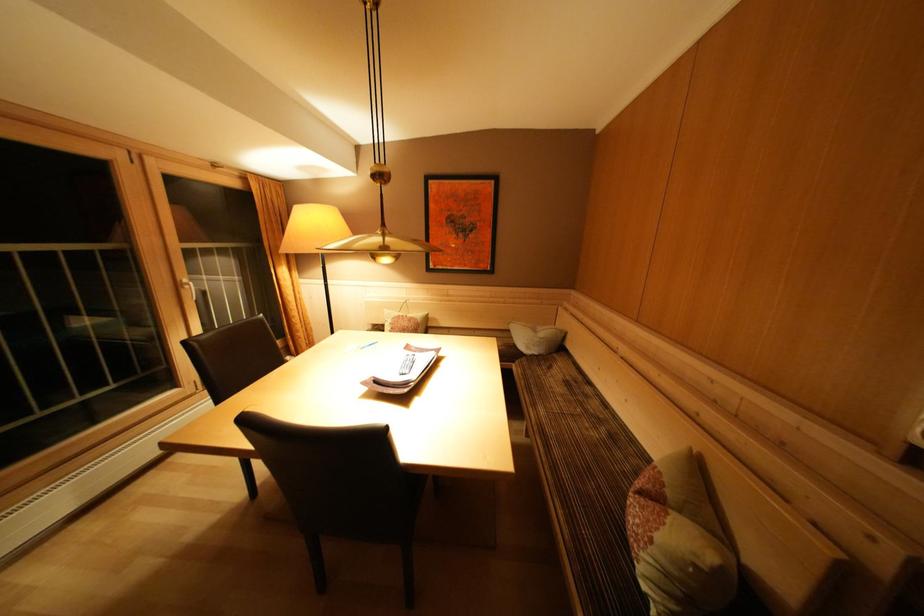
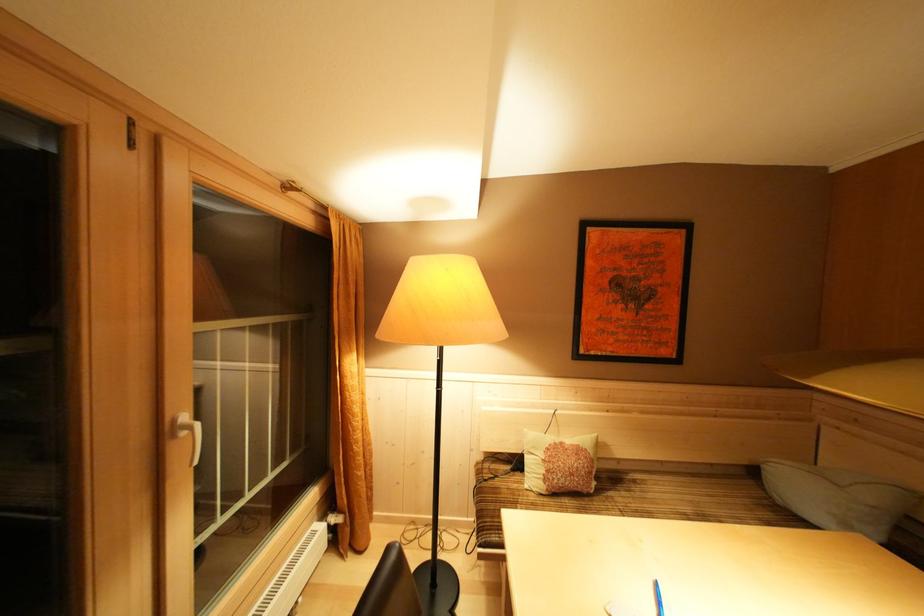
In the second image, find the point that corresponds to (x=292, y=257) in the first image.

(385, 339)